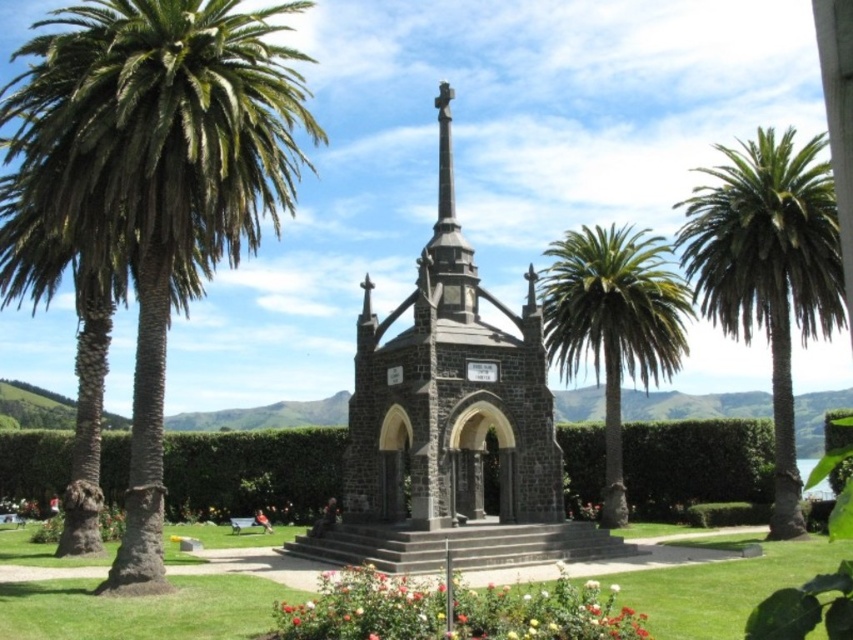
Looking at this image, you are standing at the base of the steps leading to the chapel. Looking around, you notice a point marked at coordinates (160, 173). What object is located at this coordinate?

The point at coordinates (160, 173) corresponds to a green leafy palm at left.

You are a gardener planning to plant a new flower bed between the green leafy palm at left and the multicolored petals at lower center. Considering their sizes, which area would be more suitable for smaller flowers?

The multicolored petals at lower center area is more suitable for smaller flowers since the green leafy palm at left has a larger size and may cast more shade or require more space.

You are planning to place a small garden ornament between the green hedge at center and the multicolored petals at lower center. Based on their sizes, which area would be more suitable for the ornament to ensure it is visible and not overwhelmed?

The green hedge at center has a larger size compared to multicolored petals at lower center, so placing the ornament near the multicolored petals at lower center would ensure it remains visible and isn not overshadowed by the larger hedge.